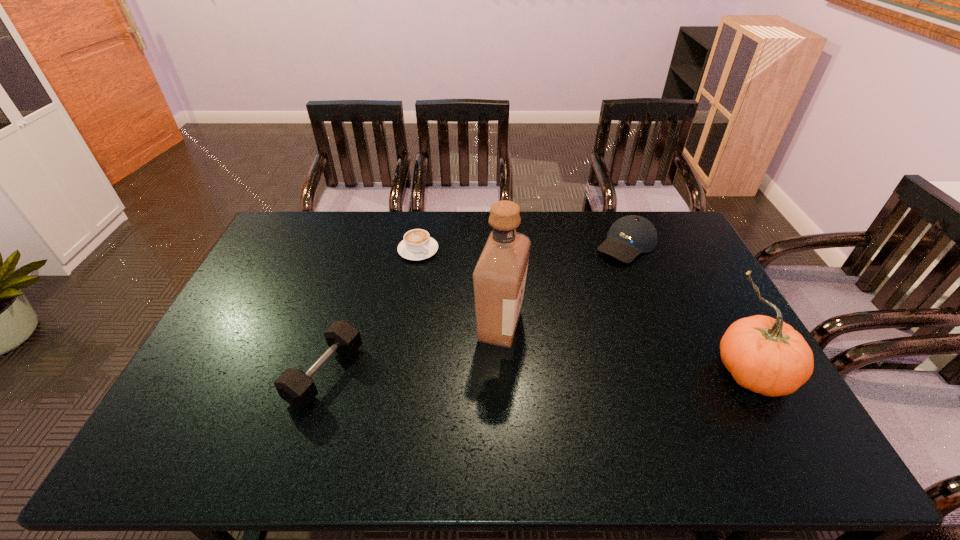
This screenshot has width=960, height=540. What are the coordinates of `dumbbell positioned at the near edge` in the screenshot? It's located at (297, 388).

In order to click on pumpkin located in the near edge section of the desktop in this screenshot , I will do `click(765, 355)`.

At what (x,y) coordinates should I click in order to perform the action: click on pumpkin that is positioned at the right edge. Please return your answer as a coordinate pair (x, y). The height and width of the screenshot is (540, 960). Looking at the image, I should click on (765, 355).

In order to click on baseball cap that is at the right edge in this screenshot , I will do (629, 236).

This screenshot has height=540, width=960. I want to click on object that is at the far right corner, so click(629, 236).

Identify the location of object present at the near right corner. The height and width of the screenshot is (540, 960). (765, 355).

This screenshot has height=540, width=960. What are the coordinates of `vacant region at the far edge` in the screenshot? It's located at (328, 227).

In the image, there is a desktop. What are the coordinates of `vacant space at the near edge` in the screenshot? It's located at (320, 417).

In the image, there is a desktop. Where is `free space at the left edge`? This screenshot has height=540, width=960. free space at the left edge is located at coordinates 252,279.

Where is `free region at the right edge of the desktop`? free region at the right edge of the desktop is located at coordinates (697, 252).